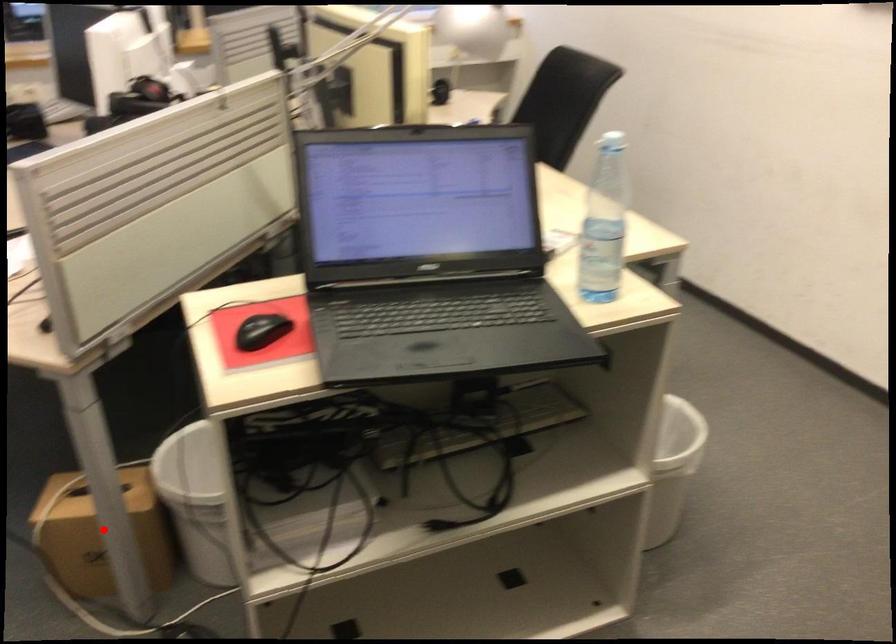
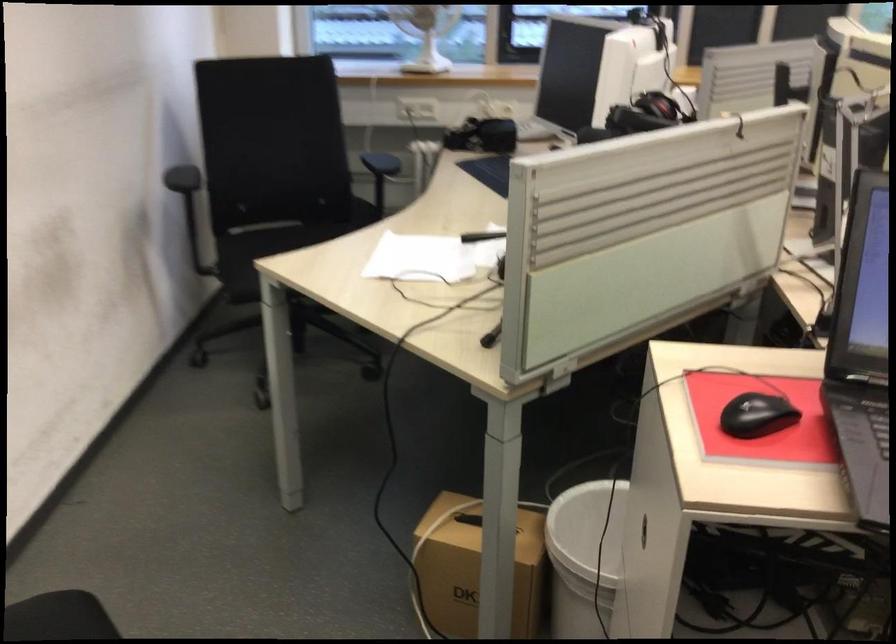
The point at the highlighted location is marked in the first image. Where is the corresponding point in the second image?

(474, 567)